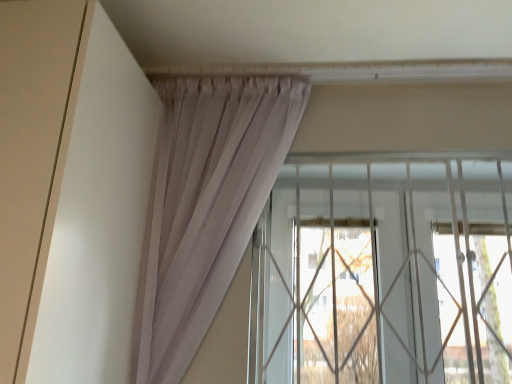
The image size is (512, 384). I want to click on white matte door at left, so (x=30, y=146).

From the picture: In order to face white matte door at left, should I rotate leftwards or rightwards?

Turn left by 30.449 degrees to look at white matte door at left.

What is the approximate width of white matte door at left?

white matte door at left is 24.41 inches in width.

The height and width of the screenshot is (384, 512). Describe the element at coordinates (30, 146) in the screenshot. I see `white matte door at left` at that location.

Consider the image. Measure the distance between white matte door at left and camera.

white matte door at left and camera are 26.22 inches apart.

Where is `transparent glass window at center`? transparent glass window at center is located at coordinates (384, 272).

What do you see at coordinates (384, 272) in the screenshot?
I see `transparent glass window at center` at bounding box center [384, 272].

I want to click on white matte door at left, so click(x=30, y=146).

In the image, is white matte door at left on the left side or the right side of transparent glass window at center?

Clearly, white matte door at left is on the left of transparent glass window at center in the image.

Which is in front, white matte door at left or transparent glass window at center?

white matte door at left.

Between point (3, 55) and point (464, 190), which one is positioned behind?

The point (464, 190) is farther from the camera.

From the image's perspective, does white matte door at left appear lower than transparent glass window at center?

No, from the image's perspective, white matte door at left is not below transparent glass window at center.

From a real-world perspective, relative to transparent glass window at center, is white matte door at left vertically above or below?

white matte door at left is above transparent glass window at center.

Can you confirm if white matte door at left is thinner than transparent glass window at center?

No, white matte door at left is not thinner than transparent glass window at center.

In terms of height, does white matte door at left look taller or shorter compared to transparent glass window at center?

In the image, white matte door at left appears to be taller than transparent glass window at center.

Considering the sizes of objects white matte door at left and transparent glass window at center in the image provided, who is smaller, white matte door at left or transparent glass window at center?

transparent glass window at center.

Is white matte door at left not within transparent glass window at center?

That's correct, white matte door at left is outside of transparent glass window at center.

Is the surface of white matte door at left in direct contact with transparent glass window at center?

white matte door at left is not next to transparent glass window at center, and they're not touching.

Is white matte door at left positioned with its back to transparent glass window at center?

That's not correct — white matte door at left is not looking away from transparent glass window at center.

Can you tell me how much white matte door at left and transparent glass window at center differ in facing direction?

white matte door at left and transparent glass window at center are facing 88 degrees away from each other.

Measure the distance between white matte door at left and transparent glass window at center.

white matte door at left is 37.48 inches away from transparent glass window at center.

This screenshot has height=384, width=512. What are the coordinates of `window behind the white matte door at left` in the screenshot? It's located at (384, 272).

Is transparent glass window at center to the right of white matte door at left from the viewer's perspective?

Yes, transparent glass window at center is to the right of white matte door at left.

Considering the positions of objects transparent glass window at center and white matte door at left in the image provided, who is behind, transparent glass window at center or white matte door at left?

Positioned behind is transparent glass window at center.

Is point (316, 197) positioned behind point (27, 99)?

Yes.

From the image's perspective, is transparent glass window at center above or below white matte door at left?

Clearly, from the image's perspective, transparent glass window at center is below white matte door at left.

From a real-world perspective, is transparent glass window at center beneath white matte door at left?

Yes, from a real-world perspective, transparent glass window at center is under white matte door at left.

In terms of width, does transparent glass window at center look wider or thinner when compared to white matte door at left?

Clearly, transparent glass window at center has less width compared to white matte door at left.

Considering the sizes of objects transparent glass window at center and white matte door at left in the image provided, who is taller, transparent glass window at center or white matte door at left?

With more height is white matte door at left.

Considering the relative sizes of transparent glass window at center and white matte door at left in the image provided, is transparent glass window at center bigger than white matte door at left?

Actually, transparent glass window at center might be smaller than white matte door at left.

Is transparent glass window at center inside the boundaries of white matte door at left, or outside?

transparent glass window at center cannot be found inside white matte door at left.

Is there a large distance between transparent glass window at center and white matte door at left?

No, transparent glass window at center is not far away from white matte door at left.

Is transparent glass window at center aimed at white matte door at left?

No.

Consider the image. Can you tell me how much transparent glass window at center and white matte door at left differ in facing direction?

transparent glass window at center and white matte door at left are facing 88 degrees away from each other.

Find the location of a particular element. The width and height of the screenshot is (512, 384). window to the right of white matte door at left is located at coordinates (384, 272).

You are a GUI agent. You are given a task and a screenshot of the screen. Output one action in this format:
    pyautogui.click(x=<x>, y=<y>)
    Task: Click on the door on the left of transparent glass window at center
    
    Given the screenshot: What is the action you would take?
    coord(30,146)

Where is `door lying in front of the transparent glass window at center`? door lying in front of the transparent glass window at center is located at coordinates (30, 146).